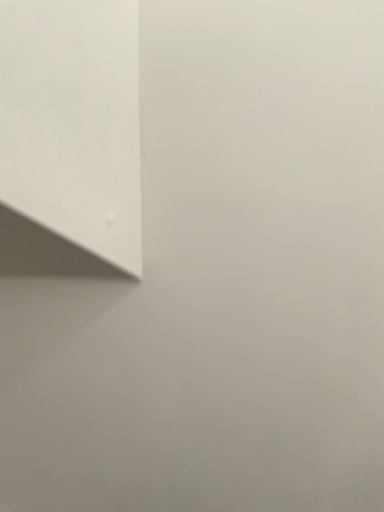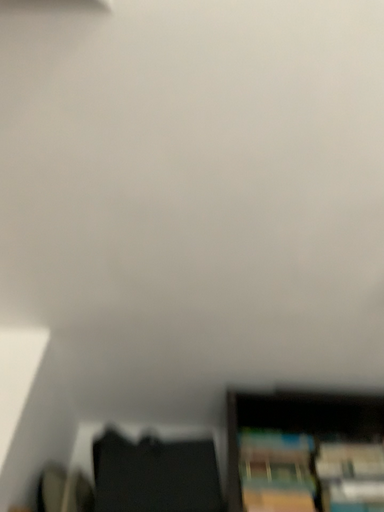
Question: How did the camera likely rotate when shooting the video?

Choices:
 (A) rotated downward
 (B) rotated upward

Answer: (A)